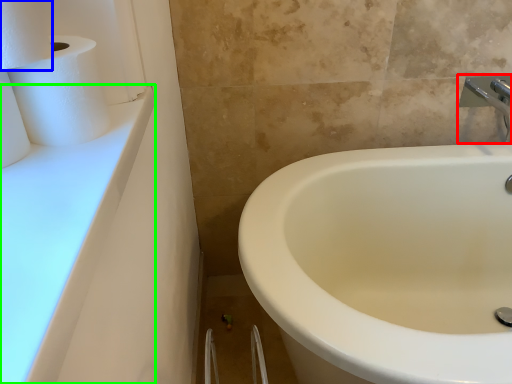
Question: Estimate the real-world distances between objects in this image. Which object is farther from tap (highlighted by a red box), toilet paper (highlighted by a blue box) or counter top (highlighted by a green box)?

Choices:
 (A) toilet paper
 (B) counter top

Answer: (A)